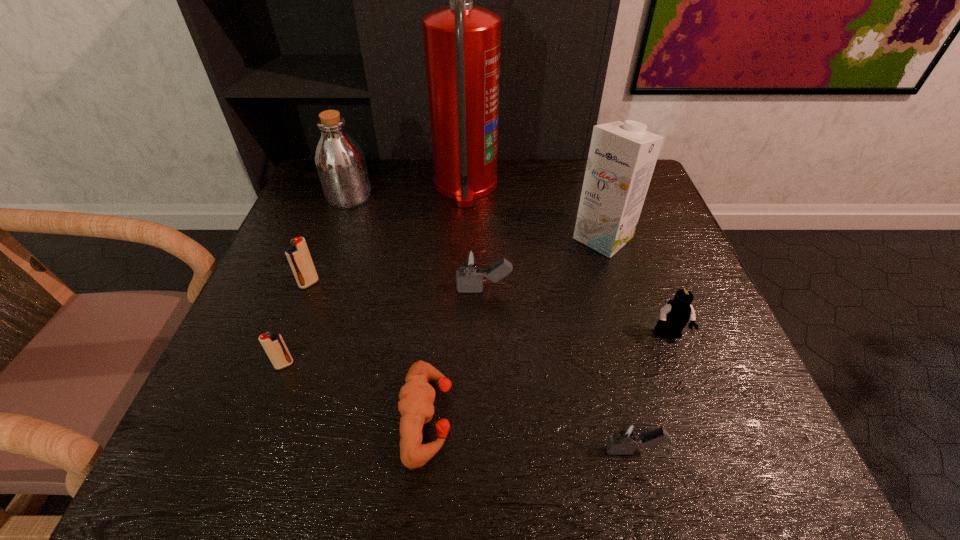
At what (x,y) coordinates should I click in order to perform the action: click on red fire extinguisher. Please return your answer as a coordinate pair (x, y). This screenshot has height=540, width=960. Looking at the image, I should click on (462, 42).

What are the coordinates of `fire extinguisher` in the screenshot? It's located at (462, 42).

Image resolution: width=960 pixels, height=540 pixels. What are the coordinates of `the eighth shortest object` in the screenshot? It's located at (622, 156).

Identify the location of carton. (622, 156).

Identify the location of the seventh shortest object. (340, 162).

The image size is (960, 540). I want to click on the third igniter from left to right, so click(x=470, y=268).

Where is `the farther gray igniter`? the farther gray igniter is located at coordinates (470, 268).

Identify the location of the bigger red igniter. The height and width of the screenshot is (540, 960). (298, 255).

Identify the location of the sixth farthest object. The width and height of the screenshot is (960, 540). (674, 316).

Where is `Lego`? The height and width of the screenshot is (540, 960). Lego is located at coordinates (674, 316).